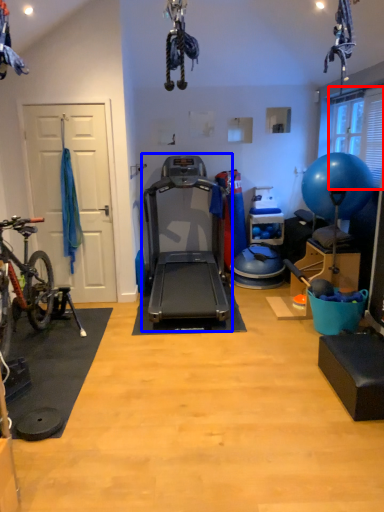
Question: Which of the following is the closest to the observer, window screen (highlighted by a red box) or treadmill (highlighted by a blue box)?

Choices:
 (A) window screen
 (B) treadmill

Answer: (B)